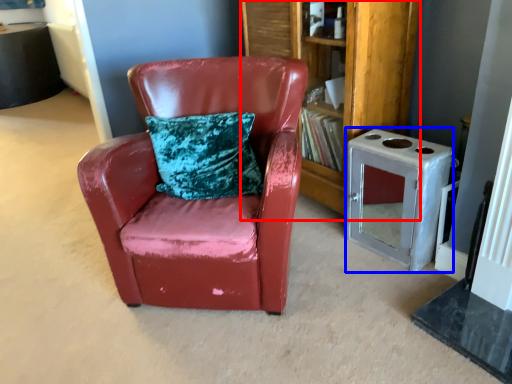
Question: Which object is closer to the camera taking this photo, bookshelf (highlighted by a red box) or appliance (highlighted by a blue box)?

Choices:
 (A) bookshelf
 (B) appliance

Answer: (B)